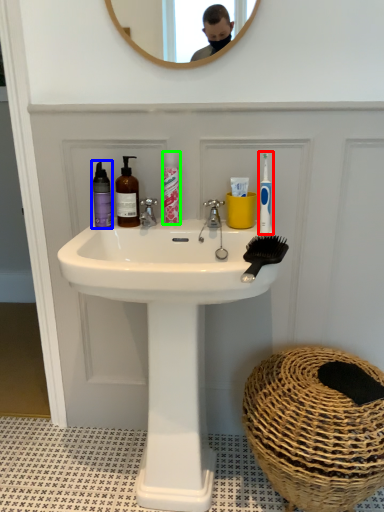
Question: Based on their relative distances, which object is farther from toothbrush (highlighted by a red box)? Choose from mouthwash (highlighted by a blue box) and mouthwash (highlighted by a green box).

Choices:
 (A) mouthwash
 (B) mouthwash

Answer: (A)